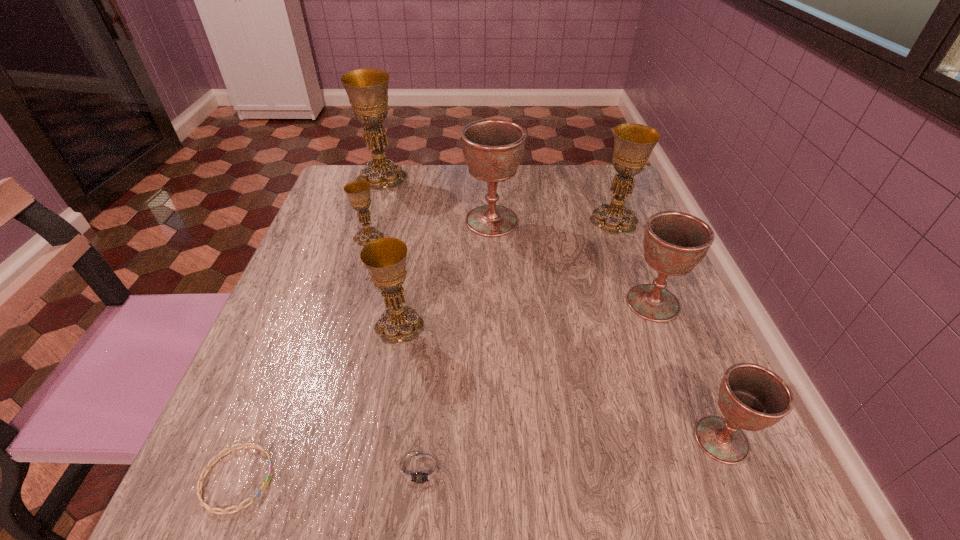
Image resolution: width=960 pixels, height=540 pixels. In order to click on free spot located on the surface of the blue bracelet showing star-shaped elements in this screenshot , I will do `click(479, 478)`.

Identify the location of chalice positioned at the near edge. This screenshot has width=960, height=540. coord(751,397).

Image resolution: width=960 pixels, height=540 pixels. I want to click on watch situated at the near edge, so click(x=422, y=470).

Find the location of a particular element. This screenshot has height=540, width=960. bracelet at the near edge is located at coordinates (200, 483).

Identify the location of bracelet at the left edge. The image size is (960, 540). (200, 483).

The width and height of the screenshot is (960, 540). In order to click on object that is positioned at the far left corner in this screenshot , I will do `click(367, 89)`.

The image size is (960, 540). Identify the location of object that is at the near left corner. (200, 483).

The image size is (960, 540). Find the location of `object at the far right corner`. object at the far right corner is located at coordinates (633, 143).

Locate an element on the screen. The width and height of the screenshot is (960, 540). object that is at the near right corner is located at coordinates (751, 397).

Find the location of a particular element. free location at the far edge of the desktop is located at coordinates (395, 206).